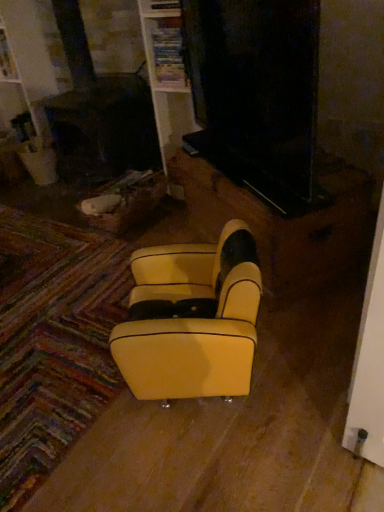
Question: Visually, is yellow leather/velvet rocking chair at center positioned to the left or to the right of yellow leather armchair at center?

Choices:
 (A) right
 (B) left

Answer: (B)

Question: From a real-world perspective, relative to yellow leather armchair at center, is yellow leather/velvet rocking chair at center vertically above or below?

Choices:
 (A) below
 (B) above

Answer: (B)

Question: In terms of size, does yellow leather/velvet rocking chair at center appear bigger or smaller than yellow leather armchair at center?

Choices:
 (A) small
 (B) big

Answer: (A)

Question: From a real-world perspective, is yellow leather armchair at center physically located above or below yellow leather/velvet rocking chair at center?

Choices:
 (A) above
 (B) below

Answer: (B)

Question: Looking at the image, does yellow leather armchair at center seem bigger or smaller compared to yellow leather/velvet rocking chair at center?

Choices:
 (A) small
 (B) big

Answer: (B)

Question: Considering the relative positions of yellow leather armchair at center and yellow leather/velvet rocking chair at center in the image provided, is yellow leather armchair at center to the left or to the right of yellow leather/velvet rocking chair at center?

Choices:
 (A) right
 (B) left

Answer: (A)

Question: Considering the positions of yellow leather armchair at center and yellow leather/velvet rocking chair at center in the image, is yellow leather armchair at center taller or shorter than yellow leather/velvet rocking chair at center?

Choices:
 (A) tall
 (B) short

Answer: (B)